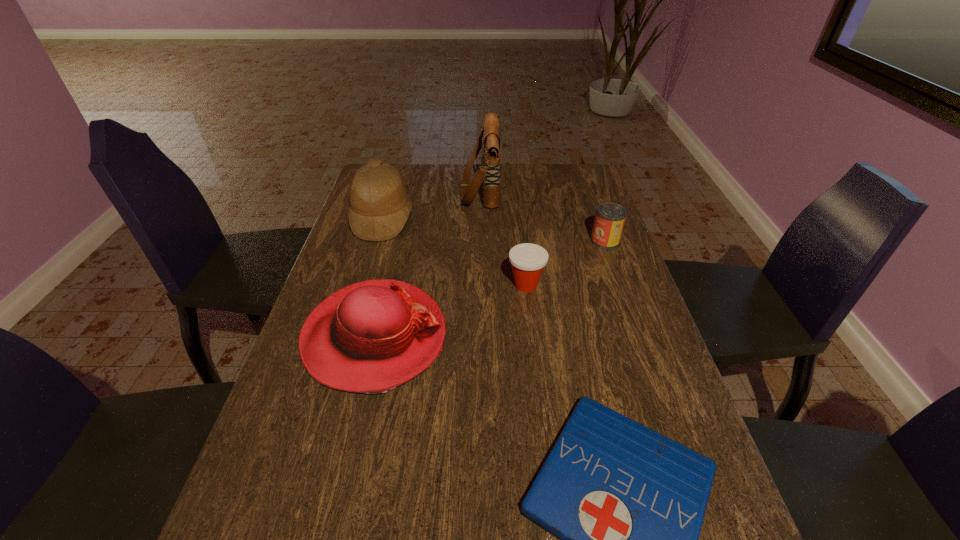
You are a GUI agent. You are given a task and a screenshot of the screen. Output one action in this format:
    pyautogui.click(x=<x>, y=<y>)
    Task: Click on the vacant space located at the front of the third tallest object with a bow
    
    Given the screenshot: What is the action you would take?
    pyautogui.click(x=500, y=336)

This screenshot has width=960, height=540. I want to click on vacant area located 0.070m on the back of the can, so coord(598,220).

At what (x,y) coordinates should I click in order to perform the action: click on free space located 0.170m on the back of the Dixie cup. Please return your answer as a coordinate pair (x, y). The height and width of the screenshot is (540, 960). Looking at the image, I should click on (520, 238).

Where is `object located at the far edge`? object located at the far edge is located at coordinates (489, 172).

I want to click on object located in the right edge section of the desktop, so click(x=610, y=217).

In the image, there is a desktop. Identify the location of vacant space at the far edge. (534, 169).

Find the location of a particular element. free region at the left edge of the desktop is located at coordinates (369, 278).

Identify the location of vacant region at the right edge of the desktop. (665, 421).

Where is `free spot between the shoulder bag and the can`? free spot between the shoulder bag and the can is located at coordinates (542, 215).

Find the location of a particular element. The height and width of the screenshot is (540, 960). free space between the can and the shoulder bag is located at coordinates (542, 215).